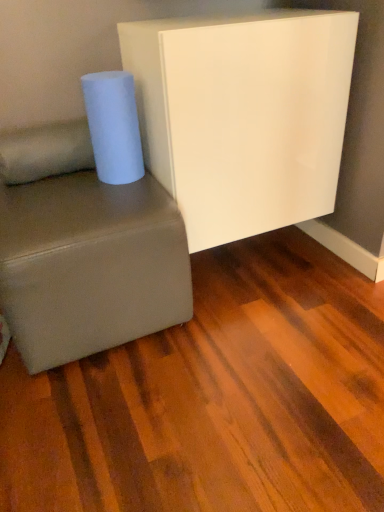
Where is `vacant area in front of soft beige fabric pillow at lower left`? The image size is (384, 512). vacant area in front of soft beige fabric pillow at lower left is located at coordinates (47, 197).